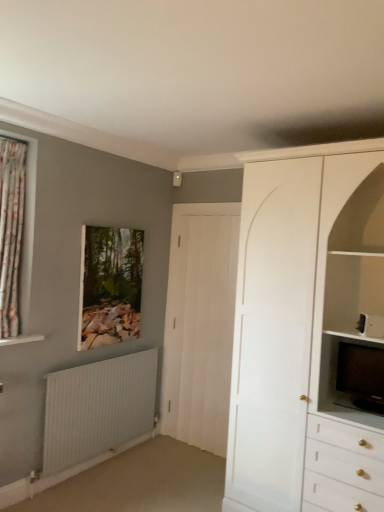
Question: From a real-world perspective, relative to white wood door at center, is floral fabric curtain at left vertically above or below?

Choices:
 (A) above
 (B) below

Answer: (A)

Question: Is floral fabric curtain at left in front of or behind white wood door at center in the image?

Choices:
 (A) front
 (B) behind

Answer: (A)

Question: Estimate the real-world distances between objects in this image. Which object is closer to the wooden frame at upper center?

Choices:
 (A) floral fabric curtain at left
 (B) white wood door at center
 (C) black glossy television at right
 (D) white ribbed radiator at lower left
 (E) white matte cabinet at upper right

Answer: (D)

Question: Estimate the real-world distances between objects in this image. Which object is farther from the black glossy television at right?

Choices:
 (A) white matte cabinet at upper right
 (B) floral fabric curtain at left
 (C) wooden frame at upper center
 (D) white ribbed radiator at lower left
 (E) white wood door at center

Answer: (B)